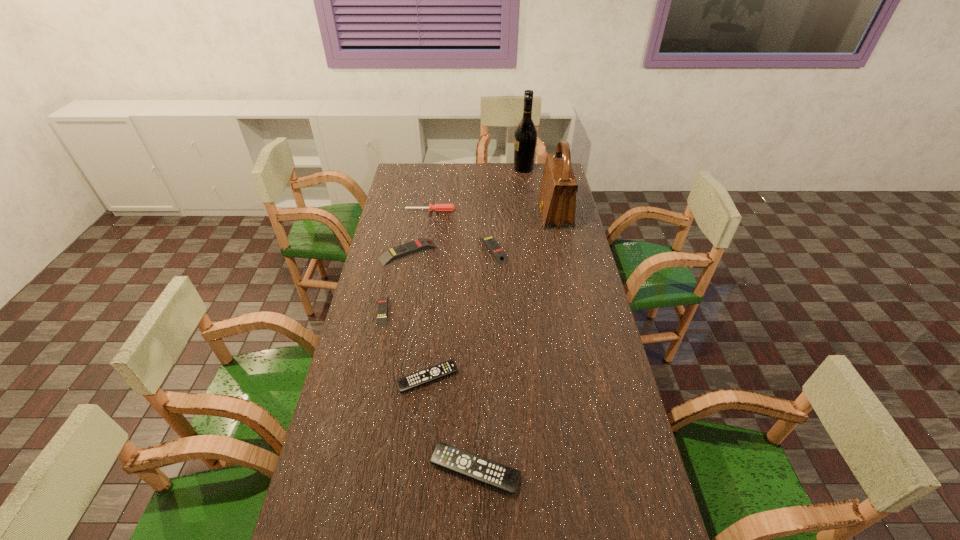
Find the location of a particular element. This screenshot has width=960, height=540. object that is the fourth closest to the nearest remote control is located at coordinates [499, 254].

Identify which object is the third nearest to the smallest yellow remote control. Please provide its 2D coordinates. Your answer should be formatted as a tuple, i.e. [(x, y)], where the tuple contains the x and y coordinates of a point satisfying the conditions above.

[(499, 254)]

Where is `remote control object that ranks as the second closest to the nearest yellow remote control`? Image resolution: width=960 pixels, height=540 pixels. remote control object that ranks as the second closest to the nearest yellow remote control is located at coordinates [x=388, y=256].

Identify the location of the third closest remote control to the screwdriver. (382, 301).

Image resolution: width=960 pixels, height=540 pixels. I want to click on yellow remote control that is the third closest to the bigger black remote control, so click(499, 254).

Image resolution: width=960 pixels, height=540 pixels. Identify the location of yellow remote control that is the second closest to the sixth farthest object. click(x=499, y=254).

Identify which black remote control is the closest to the nearest yellow remote control. Please provide its 2D coordinates. Your answer should be formatted as a tuple, i.e. [(x, y)], where the tuple contains the x and y coordinates of a point satisfying the conditions above.

[(430, 374)]

Where is `vacant area in the image that satisfies the following two spatial constraints: 1. on the label of the black wine bottle; 2. on the front side of the rightmost yellow remote control`? The height and width of the screenshot is (540, 960). vacant area in the image that satisfies the following two spatial constraints: 1. on the label of the black wine bottle; 2. on the front side of the rightmost yellow remote control is located at coordinates (535, 249).

This screenshot has height=540, width=960. I want to click on free location that satisfies the following two spatial constraints: 1. on the back side of the biggest yellow remote control; 2. on the left side of the second smallest yellow remote control, so click(x=409, y=249).

Image resolution: width=960 pixels, height=540 pixels. I want to click on free spot that satisfies the following two spatial constraints: 1. on the label of the black wine bottle; 2. on the front side of the tallest remote control, so click(536, 253).